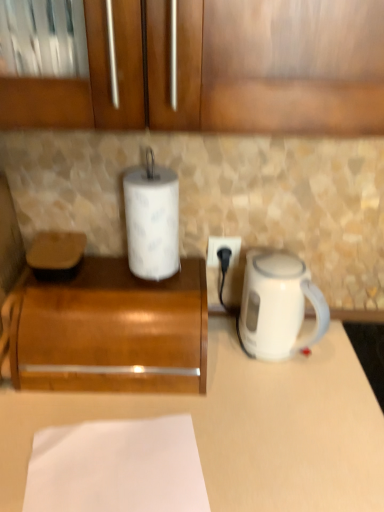
Where is `free space that is in between white glossy electric kettle at right and wooden at left`? The width and height of the screenshot is (384, 512). free space that is in between white glossy electric kettle at right and wooden at left is located at coordinates (231, 360).